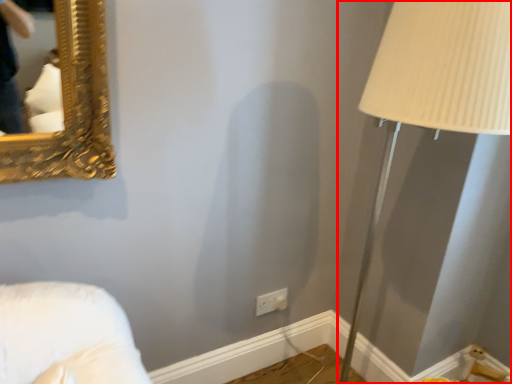
Question: From the image, what is the correct spatial relationship of table lamp (annotated by the red box) in relation to electric outlet?

Choices:
 (A) left
 (B) right

Answer: (B)